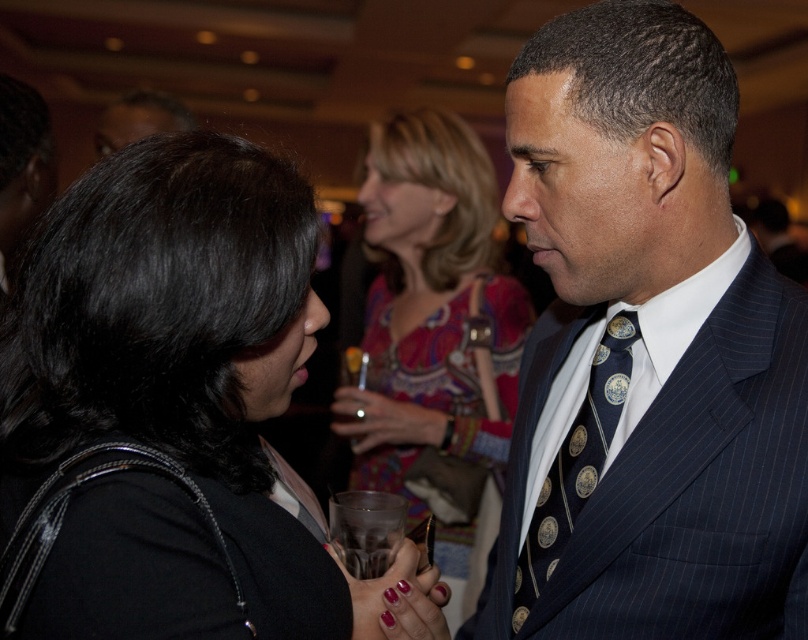
Question: Based on their relative distances, which object is farther from the printed silk blouse at center?

Choices:
 (A) navy blue silk tie at center
 (B) black fabric at center

Answer: (B)

Question: Is black fabric at center below printed silk blouse at center?

Choices:
 (A) yes
 (B) no

Answer: (A)

Question: Does black fabric at center lie behind navy blue silk tie at center?

Choices:
 (A) yes
 (B) no

Answer: (B)

Question: Estimate the real-world distances between objects in this image. Which object is farther from the printed silk blouse at center?

Choices:
 (A) navy blue silk tie at center
 (B) black fabric at center

Answer: (B)

Question: Does printed silk blouse at center appear under navy blue silk tie at center?

Choices:
 (A) yes
 (B) no

Answer: (B)

Question: Which object appears closest to the camera in this image?

Choices:
 (A) black fabric at center
 (B) dark blue pinstripe suit at center
 (C) navy blue silk tie at center
 (D) printed silk blouse at center

Answer: (A)